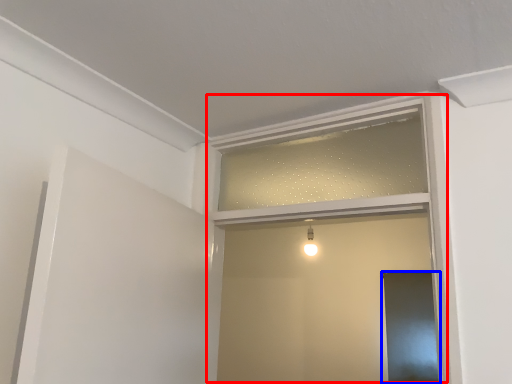
Question: Which point is closer to the camera, window frame (highlighted by a red box) or screen door (highlighted by a blue box)?

Choices:
 (A) window frame
 (B) screen door

Answer: (A)